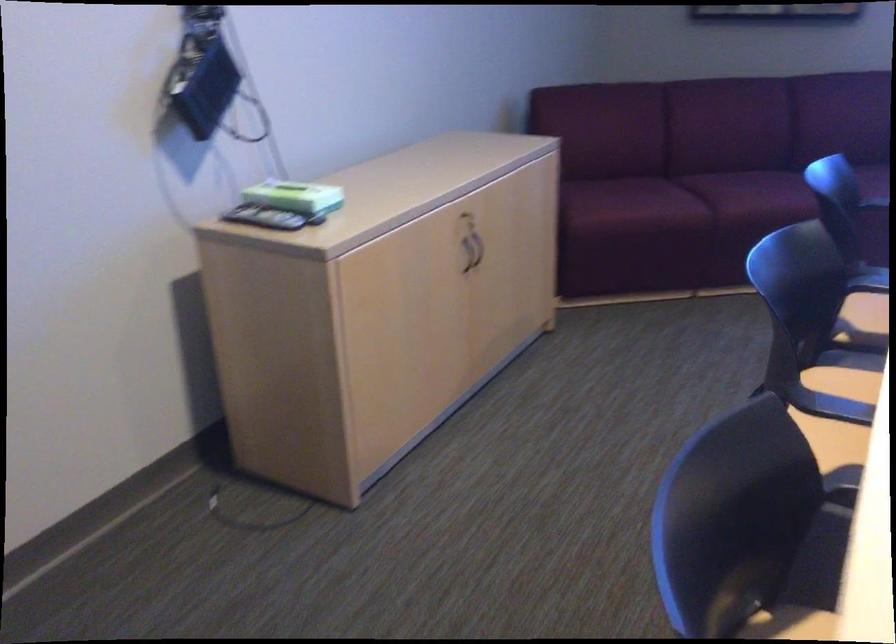
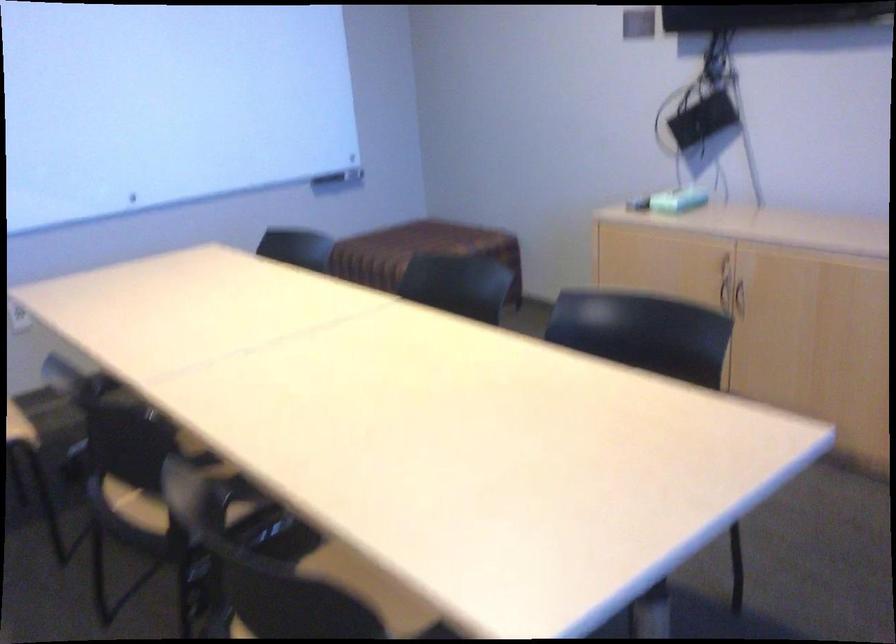
Find the pixel in the second image that matches [472,261] in the first image.

(738, 299)